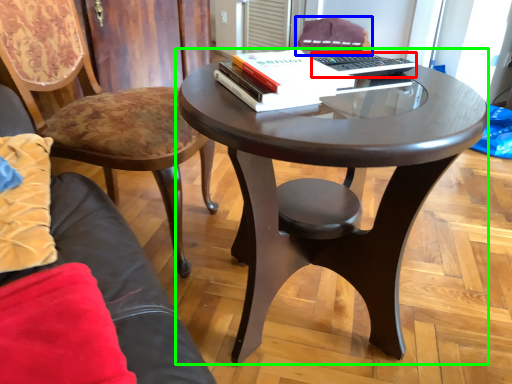
Question: Considering the real-world distances, which object is farthest from laptop keyboard (highlighted by a red box)? chair (highlighted by a blue box) or coffee table (highlighted by a green box)?

Choices:
 (A) chair
 (B) coffee table

Answer: (A)